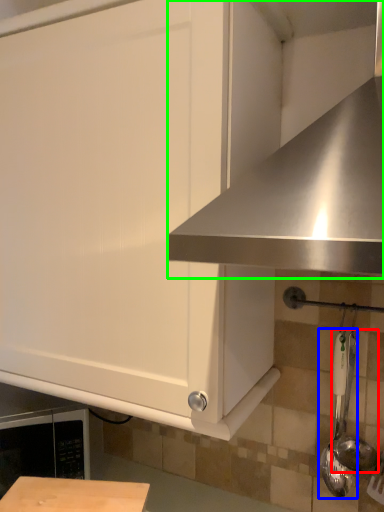
Question: Estimate the real-world distances between objects in this image. Which object is farther from utensil (highlighted by a red box), utensil (highlighted by a blue box) or exhaust hood (highlighted by a green box)?

Choices:
 (A) utensil
 (B) exhaust hood

Answer: (B)